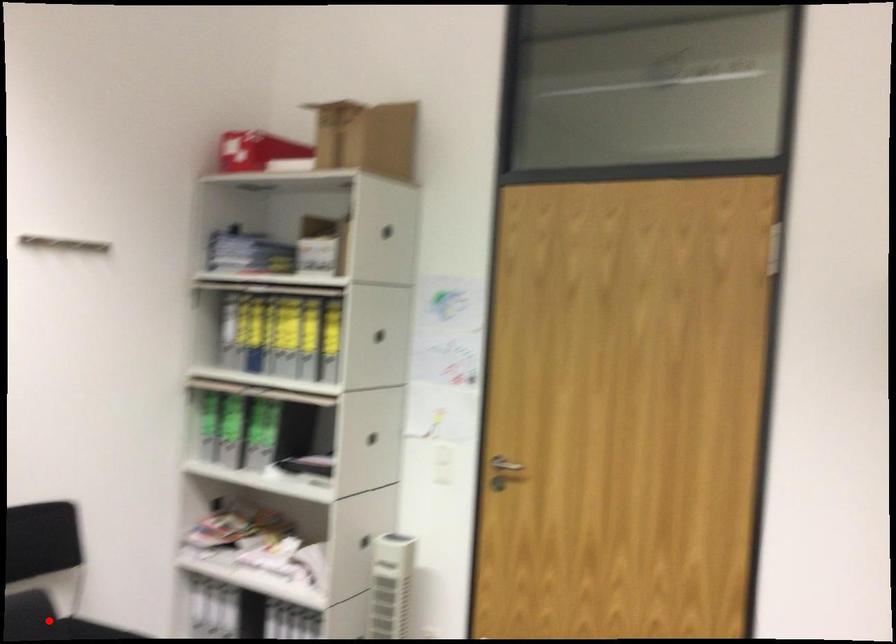
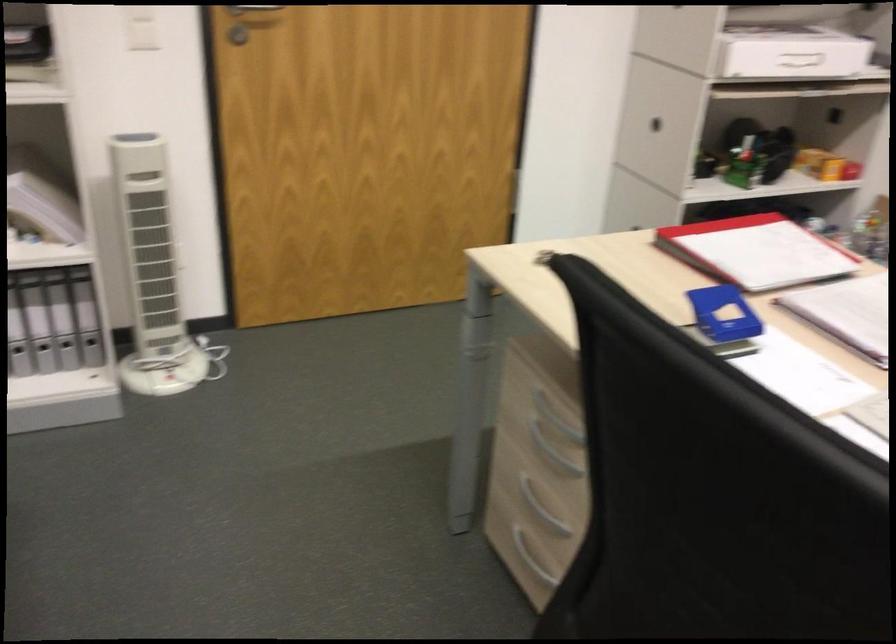
Question: I am providing you with two images of the same scene from different viewpoints. A red point is marked on the first image. Is the red point's position out of view in image 2?

Choices:
 (A) Yes
 (B) No

Answer: (A)